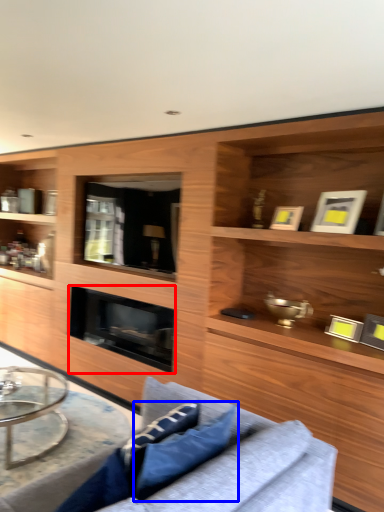
Question: Which object appears closest to the camera in this image, fireplace (highlighted by a red box) or pillow (highlighted by a blue box)?

Choices:
 (A) fireplace
 (B) pillow

Answer: (B)